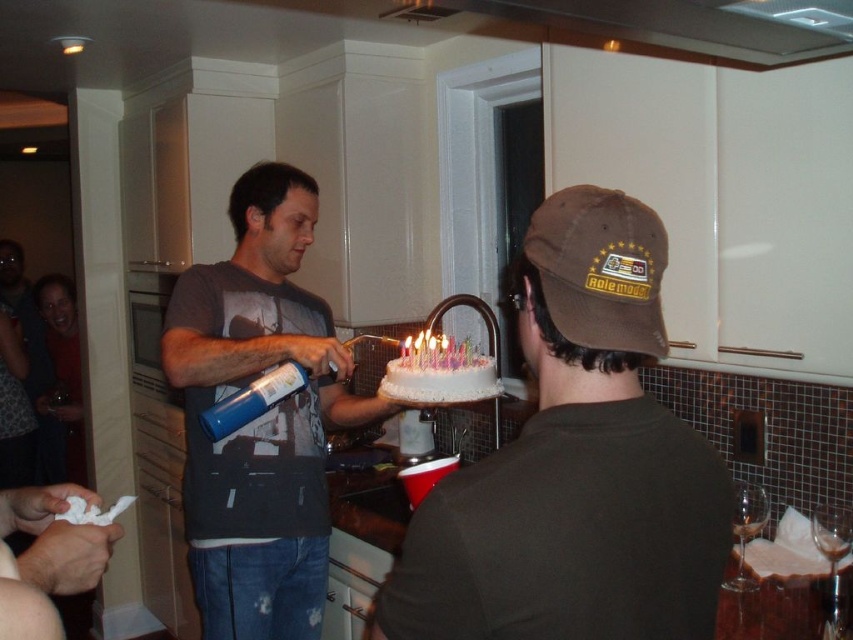
Question: Does matte gray t-shirt at center have a larger size compared to white frosted cake at center?

Choices:
 (A) no
 (B) yes

Answer: (B)

Question: Which point appears farthest from the camera in this image?

Choices:
 (A) (260, 348)
 (B) (403, 374)

Answer: (A)

Question: Which object is positioned closest to the brown cotton cap at center?

Choices:
 (A) white frosted cake at center
 (B) brown fabric baseball cap at upper right
 (C) matte gray t-shirt at center

Answer: (B)

Question: Based on their relative distances, which object is nearer to the white frosted cake at center?

Choices:
 (A) brown fabric baseball cap at upper right
 (B) matte gray t-shirt at center

Answer: (B)

Question: Does brown cotton cap at center appear on the right side of brown fabric baseball cap at upper right?

Choices:
 (A) no
 (B) yes

Answer: (A)

Question: Is matte gray t-shirt at center wider than brown fabric baseball cap at upper right?

Choices:
 (A) no
 (B) yes

Answer: (B)